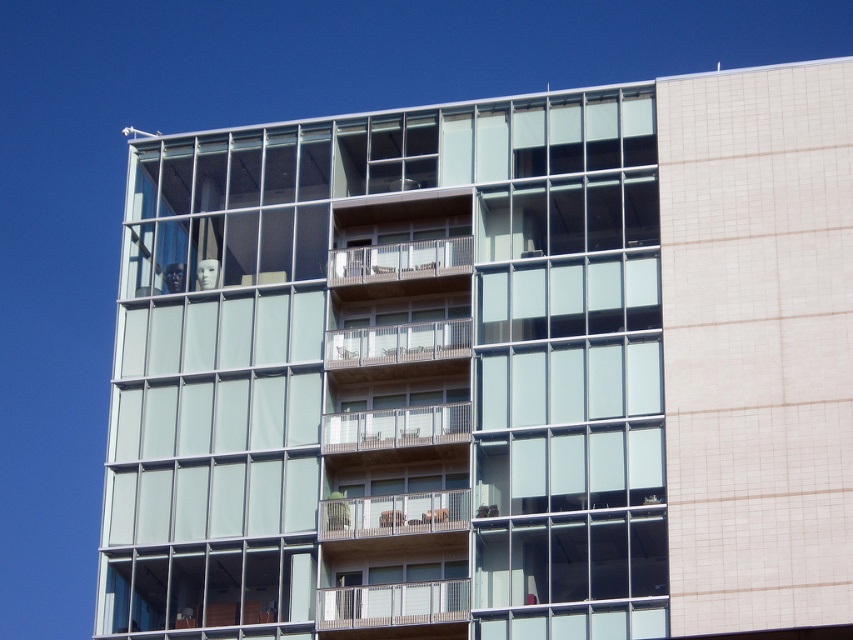
Between wooden brown balcony at center and wooden balcony at center, which one appears on the left side from the viewer's perspective?

From the viewer's perspective, wooden balcony at center appears more on the left side.

I want to click on wooden brown balcony at center, so click(393, 513).

Is point (363, 525) positioned before point (399, 419)?

Yes, it is in front of point (399, 419).

Where is `wooden brown balcony at center`? The width and height of the screenshot is (853, 640). wooden brown balcony at center is located at coordinates (393, 513).

Who is positioned more to the right, wooden balcony at center or brown wooden balcony at center?

brown wooden balcony at center is more to the right.

Image resolution: width=853 pixels, height=640 pixels. In order to click on wooden balcony at center in this screenshot , I will do `click(395, 428)`.

How distant is wooden railing at lower center from wooden at center?

wooden railing at lower center is 7.94 meters from wooden at center.

From the picture: Who is more distant from viewer, (440, 600) or (331, 346)?

Positioned behind is point (331, 346).

Where is `wooden railing at lower center`? The image size is (853, 640). wooden railing at lower center is located at coordinates point(392,604).